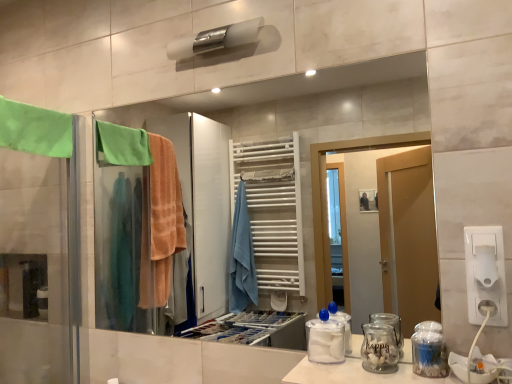
You are a GUI agent. You are given a task and a screenshot of the screen. Output one action in this format:
    pyautogui.click(x=<x>, y=<y>)
    Task: Click on the free spot above white matte towel bar at upper center (from a real-world perspective)
    Image resolution: width=512 pixels, height=384 pixels.
    Given the screenshot: What is the action you would take?
    pyautogui.click(x=217, y=11)